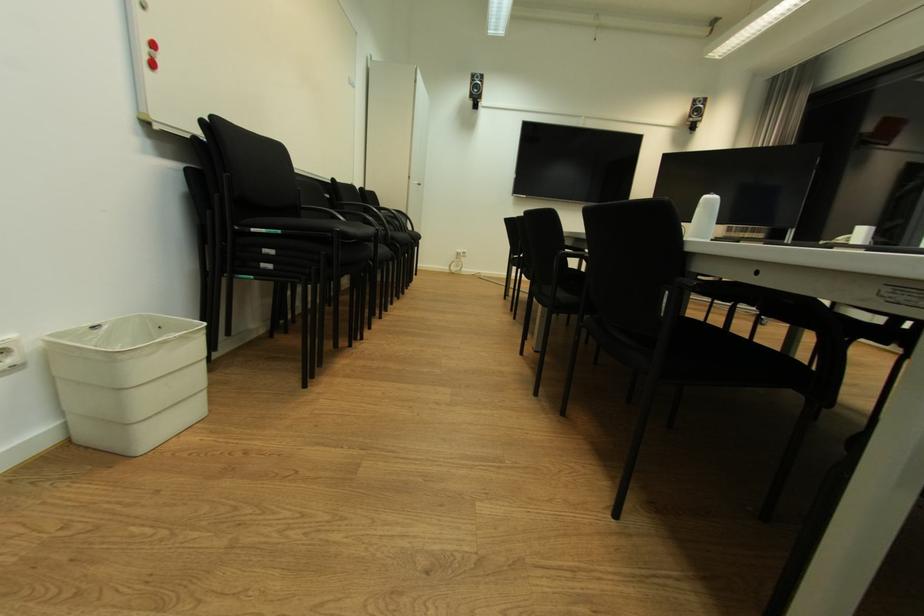
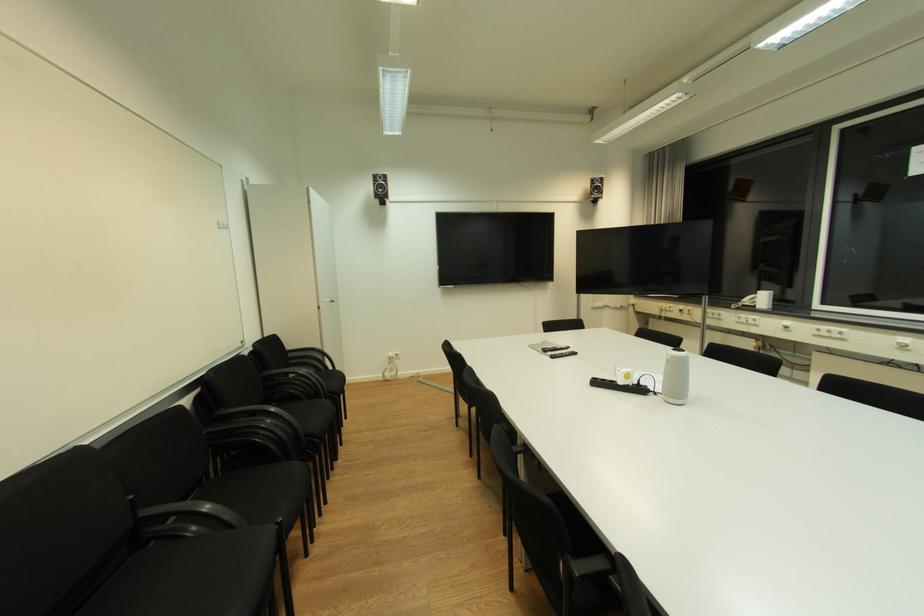
The point at (x=465, y=252) is marked in the first image. Where is the corresponding point in the second image?

(396, 355)